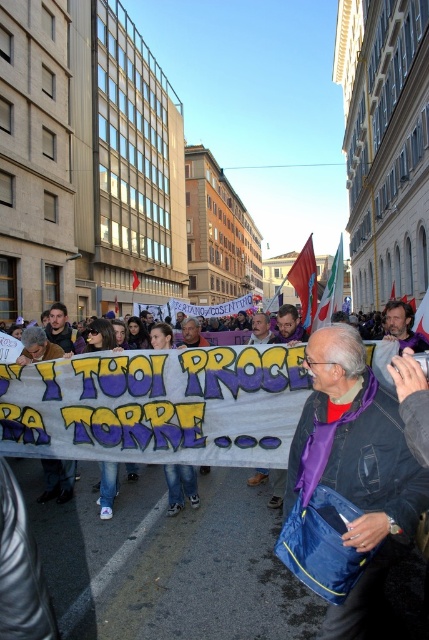
Who is more distant from viewer, (x=341, y=618) or (x=299, y=275)?

The point (x=299, y=275) is behind.

Does purple fabric bag at center have a greater width compared to red fabric flag at center?

No.

Is point (301, 420) positioned behind point (296, 269)?

That is False.

I want to click on purple fabric bag at center, so click(356, 472).

Is purple fabric bag at center bigger than white fabric flag at center?

Incorrect, purple fabric bag at center is not larger than white fabric flag at center.

The width and height of the screenshot is (429, 640). Describe the element at coordinates (356, 472) in the screenshot. I see `purple fabric bag at center` at that location.

Image resolution: width=429 pixels, height=640 pixels. Identify the location of purple fabric bag at center. (356, 472).

Does point (305, 300) lie in front of point (331, 273)?

Yes, point (305, 300) is closer to viewer.

Does red fabric flag at center have a lesser width compared to white fabric flag at center?

Correct, red fabric flag at center's width is less than white fabric flag at center's.

Where is `red fabric flag at center`? red fabric flag at center is located at coordinates (305, 282).